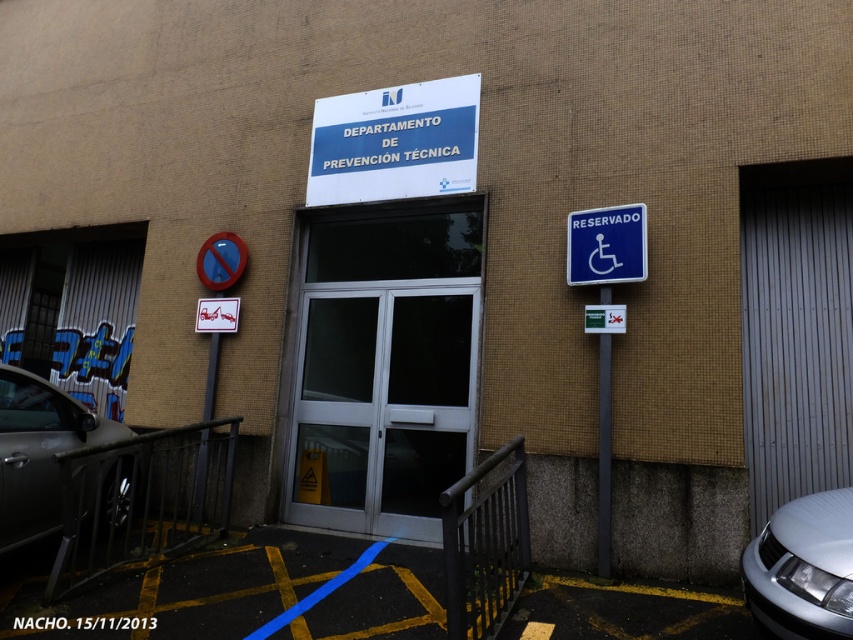
Question: Estimate the real-world distances between objects in this image. Which object is farther from the white plastic sign at upper center?

Choices:
 (A) blue plastic sign at right
 (B) white glass door at center

Answer: (A)

Question: Can you confirm if white plastic sign at upper center is wider than blue plastic sign at right?

Choices:
 (A) yes
 (B) no

Answer: (A)

Question: Which of these objects is positioned farthest from the shiny black car at lower left?

Choices:
 (A) white glass door at center
 (B) silver metallic car at lower right
 (C) white plastic sign at upper center
 (D) blue plastic sign at right

Answer: (B)

Question: Considering the real-world distances, which object is closest to the white glass door at center?

Choices:
 (A) white plastic sign at upper center
 (B) blue plastic sign at right
 (C) shiny black car at lower left
 (D) silver metallic car at lower right

Answer: (A)

Question: Does white glass door at center appear on the right side of silver metallic car at lower right?

Choices:
 (A) no
 (B) yes

Answer: (A)

Question: Considering the relative positions of shiny black car at lower left and blue plastic sign at right in the image provided, where is shiny black car at lower left located with respect to blue plastic sign at right?

Choices:
 (A) below
 (B) above

Answer: (A)